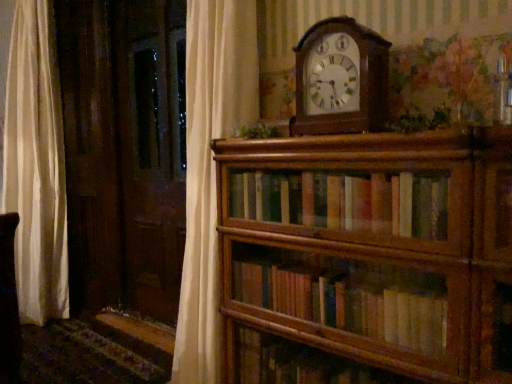
I want to click on green leafy plant at upper center, the 2th plant positioned from the back, so click(420, 120).

Image resolution: width=512 pixels, height=384 pixels. What do you see at coordinates (341, 79) in the screenshot?
I see `wooden wall clock at upper center` at bounding box center [341, 79].

Locate an element on the screen. The width and height of the screenshot is (512, 384). wooden bookshelf at center is located at coordinates (367, 257).

Locate an element on the screen. The height and width of the screenshot is (384, 512). green leafy plant at upper center, which appears as the 2th plant when viewed from the left is located at coordinates (420, 120).

Can you tell me how much green leafy plant at upper center, placed as the first plant when sorted from back to front, and green leafy plant at upper center, which appears as the 2th plant when viewed from the left, differ in facing direction?

1.1 degrees separate the facing orientations of green leafy plant at upper center, placed as the first plant when sorted from back to front, and green leafy plant at upper center, which appears as the 2th plant when viewed from the left.

Does green leafy plant at upper center, which is the 2th plant in right-to-left order, have a lesser height compared to green leafy plant at upper center, the first plant viewed from the right?

Correct, green leafy plant at upper center, which is the 2th plant in right-to-left order, is not as tall as green leafy plant at upper center, the first plant viewed from the right.

Can you confirm if green leafy plant at upper center, the second plant in the front-to-back sequence, is bigger than green leafy plant at upper center, the 2th plant positioned from the back?

Actually, green leafy plant at upper center, the second plant in the front-to-back sequence, might be smaller than green leafy plant at upper center, the 2th plant positioned from the back.

From the image's perspective, is green leafy plant at upper center, placed as the first plant when sorted from back to front, located above or below green leafy plant at upper center, positioned as the 1th plant in front-to-back order?

Clearly, from the image's perspective, green leafy plant at upper center, placed as the first plant when sorted from back to front, is above green leafy plant at upper center, positioned as the 1th plant in front-to-back order.

From a real-world perspective, which object stands above the other?

green leafy plant at upper center, the second plant in the front-to-back sequence, is physically above.

How far apart are wooden bookshelf at center and green leafy plant at upper center, the second plant in the front-to-back sequence?

wooden bookshelf at center and green leafy plant at upper center, the second plant in the front-to-back sequence, are 20.19 inches apart from each other.

Considering the relative sizes of wooden bookshelf at center and green leafy plant at upper center, the second plant in the front-to-back sequence, in the image provided, is wooden bookshelf at center thinner than green leafy plant at upper center, the second plant in the front-to-back sequence,?

No.

Which point is more forward, (336, 310) or (252, 135)?

The point (336, 310) is more forward.

From the image's perspective, which one is positioned higher, wooden wall clock at upper center or wooden bookshelf at center?

wooden wall clock at upper center appears higher in the image.

Is there a large distance between wooden wall clock at upper center and wooden bookshelf at center?

No, wooden wall clock at upper center is not far from wooden bookshelf at center.

Considering the relative sizes of wooden wall clock at upper center and wooden bookshelf at center in the image provided, is wooden wall clock at upper center shorter than wooden bookshelf at center?

Indeed, wooden wall clock at upper center has a lesser height compared to wooden bookshelf at center.

From a real-world perspective, between wooden wall clock at upper center and wooden bookshelf at center, who is vertically higher?

From a 3D spatial view, wooden wall clock at upper center is above.

From the image's perspective, which object appears higher, wooden wall clock at upper center or green leafy plant at upper center, the 2th plant positioned from the back?

wooden wall clock at upper center is shown above in the image.

In the image, is wooden wall clock at upper center positioned in front of or behind green leafy plant at upper center, positioned as the 1th plant in front-to-back order?

wooden wall clock at upper center is positioned farther from the viewer than green leafy plant at upper center, positioned as the 1th plant in front-to-back order.

Is wooden wall clock at upper center oriented towards green leafy plant at upper center, the first plant viewed from the right?

No, wooden wall clock at upper center is not oriented towards green leafy plant at upper center, the first plant viewed from the right.

Locate an element on the screen. The height and width of the screenshot is (384, 512). plant on the right of the wooden wall clock at upper center is located at coordinates (420, 120).

Measure the distance between wooden wall clock at upper center and green leafy plant at upper center, the second plant in the front-to-back sequence.

wooden wall clock at upper center is 31.62 centimeters from green leafy plant at upper center, the second plant in the front-to-back sequence.

Who is taller, wooden wall clock at upper center or green leafy plant at upper center, the second plant in the front-to-back sequence?

Standing taller between the two is wooden wall clock at upper center.

Is wooden wall clock at upper center wider or thinner than green leafy plant at upper center, the second plant in the front-to-back sequence?

Clearly, wooden wall clock at upper center has more width compared to green leafy plant at upper center, the second plant in the front-to-back sequence.

Who is smaller, wooden wall clock at upper center or green leafy plant at upper center, placed as the 1th plant when sorted from left to right?

green leafy plant at upper center, placed as the 1th plant when sorted from left to right, is smaller.

Considering the sizes of objects green leafy plant at upper center, which is the 2th plant in right-to-left order, and wooden bookshelf at center in the image provided, who is wider, green leafy plant at upper center, which is the 2th plant in right-to-left order, or wooden bookshelf at center?

With larger width is wooden bookshelf at center.

Is green leafy plant at upper center, the second plant in the front-to-back sequence, at the left side of wooden bookshelf at center?

Indeed, green leafy plant at upper center, the second plant in the front-to-back sequence, is positioned on the left side of wooden bookshelf at center.

From a real-world perspective, is green leafy plant at upper center, the second plant in the front-to-back sequence, under wooden bookshelf at center?

Actually, green leafy plant at upper center, the second plant in the front-to-back sequence, is physically above wooden bookshelf at center in the real world.

Does green leafy plant at upper center, which is the 2th plant in right-to-left order, have a lesser height compared to wooden bookshelf at center?

Indeed, green leafy plant at upper center, which is the 2th plant in right-to-left order, has a lesser height compared to wooden bookshelf at center.

In terms of width, does wooden bookshelf at center look wider or thinner when compared to wooden wall clock at upper center?

wooden bookshelf at center is wider than wooden wall clock at upper center.

Is wooden bookshelf at center bigger than wooden wall clock at upper center?

Yes, wooden bookshelf at center is bigger than wooden wall clock at upper center.

Where is `plant below the green leafy plant at upper center, the second plant in the front-to-back sequence (from the image's perspective)`? The width and height of the screenshot is (512, 384). plant below the green leafy plant at upper center, the second plant in the front-to-back sequence (from the image's perspective) is located at coordinates (420, 120).

From a real-world perspective, starting from the wooden bookshelf at center, which plant is the 1st one vertically above it? Please provide its 2D coordinates.

[(260, 130)]

Estimate the real-world distances between objects in this image. Which object is further from wooden wall clock at upper center, green leafy plant at upper center, the 2th plant positioned from the back, or wooden bookshelf at center?

wooden bookshelf at center is positioned further to the anchor wooden wall clock at upper center.

Which object lies nearer to the anchor point green leafy plant at upper center, which appears as the 2th plant when viewed from the left, wooden wall clock at upper center or wooden bookshelf at center?

wooden wall clock at upper center is closer to green leafy plant at upper center, which appears as the 2th plant when viewed from the left.

From the image, which object appears to be farther from green leafy plant at upper center, which appears as the 2th plant when viewed from the left, green leafy plant at upper center, the second plant in the front-to-back sequence, or wooden bookshelf at center?

green leafy plant at upper center, the second plant in the front-to-back sequence, is positioned further to the anchor green leafy plant at upper center, which appears as the 2th plant when viewed from the left.

When comparing their distances from green leafy plant at upper center, which appears as the 2th plant when viewed from the left, does wooden wall clock at upper center or green leafy plant at upper center, which is the 2th plant in right-to-left order, seem further?

green leafy plant at upper center, which is the 2th plant in right-to-left order, is positioned further to the anchor green leafy plant at upper center, which appears as the 2th plant when viewed from the left.

Which object lies further to the anchor point green leafy plant at upper center, which is the 2th plant in right-to-left order, wooden wall clock at upper center or wooden bookshelf at center?

wooden bookshelf at center.

Which object lies nearer to the anchor point wooden wall clock at upper center, green leafy plant at upper center, the first plant viewed from the right, or green leafy plant at upper center, the second plant in the front-to-back sequence?

Among the two, green leafy plant at upper center, the first plant viewed from the right, is located nearer to wooden wall clock at upper center.

Estimate the real-world distances between objects in this image. Which object is further from wooden bookshelf at center, green leafy plant at upper center, placed as the 1th plant when sorted from left to right, or green leafy plant at upper center, the first plant viewed from the right?

The object further to wooden bookshelf at center is green leafy plant at upper center, placed as the 1th plant when sorted from left to right.

Considering their positions, is green leafy plant at upper center, placed as the 1th plant when sorted from left to right, positioned closer to wooden wall clock at upper center than wooden bookshelf at center?

green leafy plant at upper center, placed as the 1th plant when sorted from left to right.

Identify the location of wall clock between green leafy plant at upper center, which is the 2th plant in right-to-left order, and green leafy plant at upper center, positioned as the 1th plant in front-to-back order. The width and height of the screenshot is (512, 384). (341, 79).

This screenshot has width=512, height=384. Identify the location of plant between green leafy plant at upper center, placed as the first plant when sorted from back to front, and wooden bookshelf at center in the up-down direction. (420, 120).